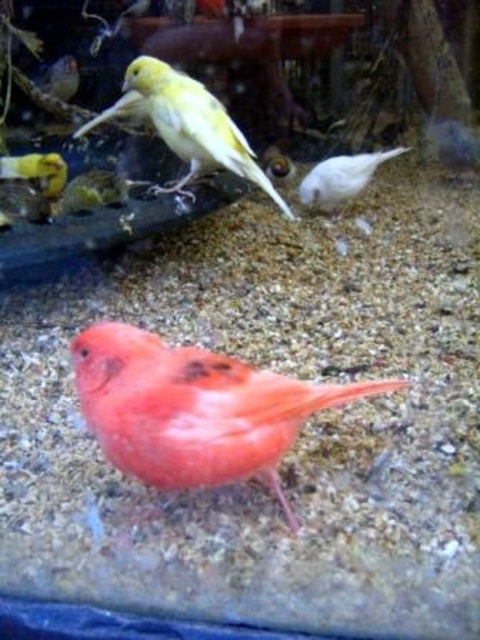
Question: Which is farther from the white matte bird at center?

Choices:
 (A) matte orange bird at center
 (B) yellow matte canary at upper center

Answer: (A)

Question: Where is matte orange bird at center located in relation to white matte bird at center in the image?

Choices:
 (A) left
 (B) right

Answer: (A)

Question: Which point appears farthest from the camera in this image?

Choices:
 (A) (352, 186)
 (B) (226, 109)

Answer: (A)

Question: Is matte orange bird at center below white matte bird at center?

Choices:
 (A) yes
 (B) no

Answer: (A)

Question: Estimate the real-world distances between objects in this image. Which object is closer to the yellow matte canary at upper center?

Choices:
 (A) white matte bird at center
 (B) matte orange bird at center

Answer: (A)

Question: In this image, where is matte orange bird at center located relative to yellow matte canary at upper center?

Choices:
 (A) above
 (B) below

Answer: (B)